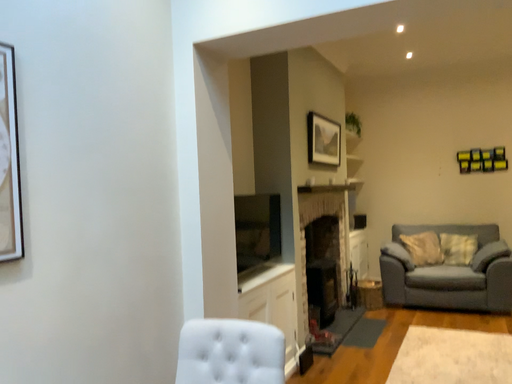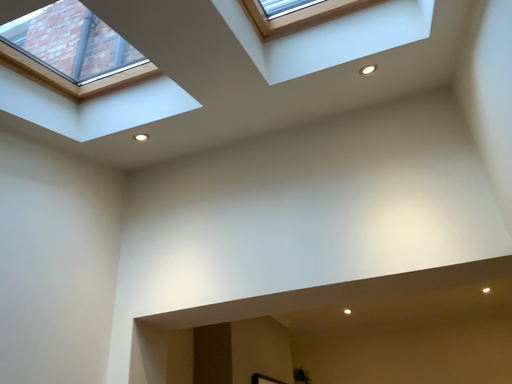
Question: How did the camera likely rotate when shooting the video?

Choices:
 (A) rotated downward
 (B) rotated upward

Answer: (B)